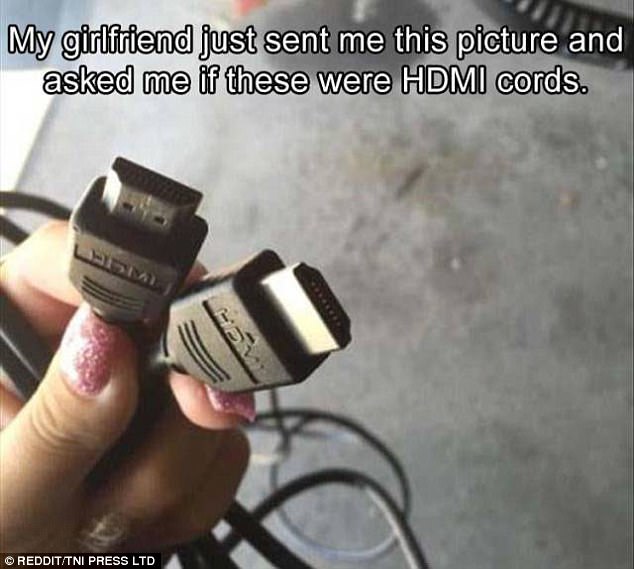
Where is `concrete flooring`? The image size is (634, 569). concrete flooring is located at coordinates (387, 365).